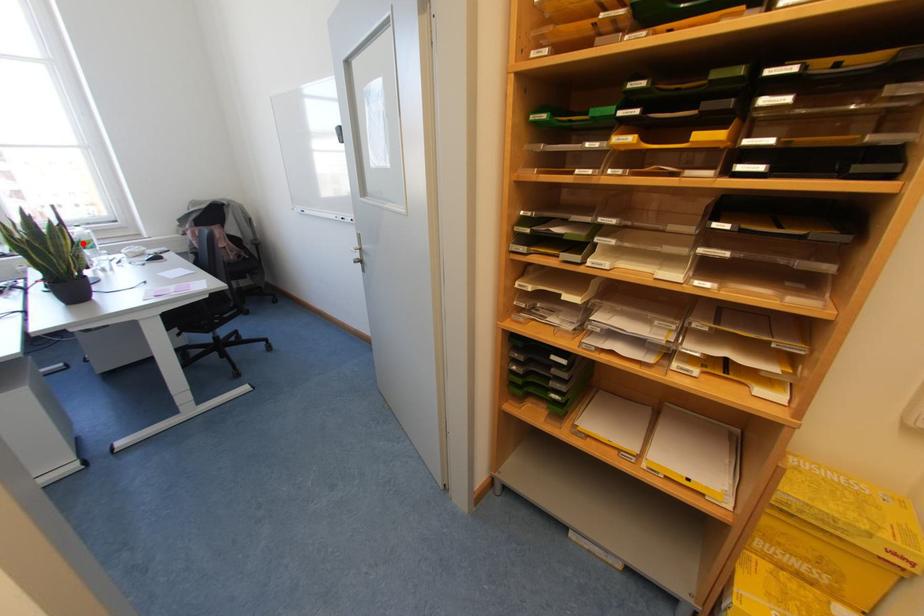
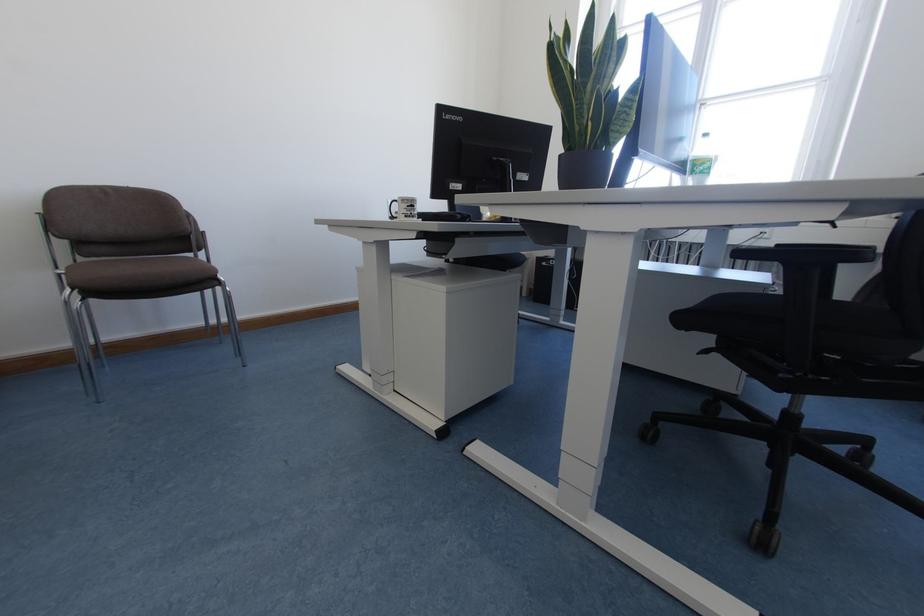
Question: I am providing you with two images of the same scene from different viewpoints. A red point is shown in image1. For the corresponding object point in image2, is it positioned nearer or farther from the camera?

Choices:
 (A) Nearer
 (B) Farther

Answer: (A)